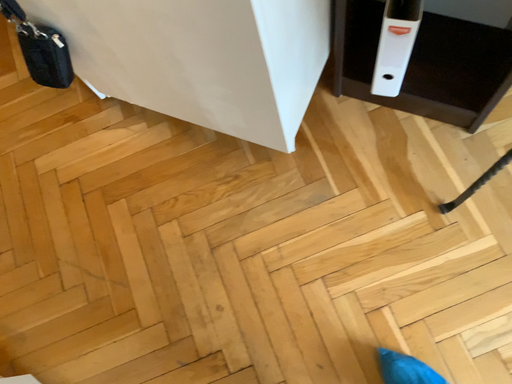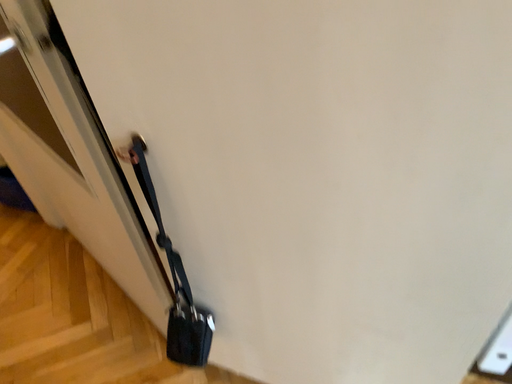
Question: Which way did the camera rotate in the video?

Choices:
 (A) rotated upward
 (B) rotated downward

Answer: (A)